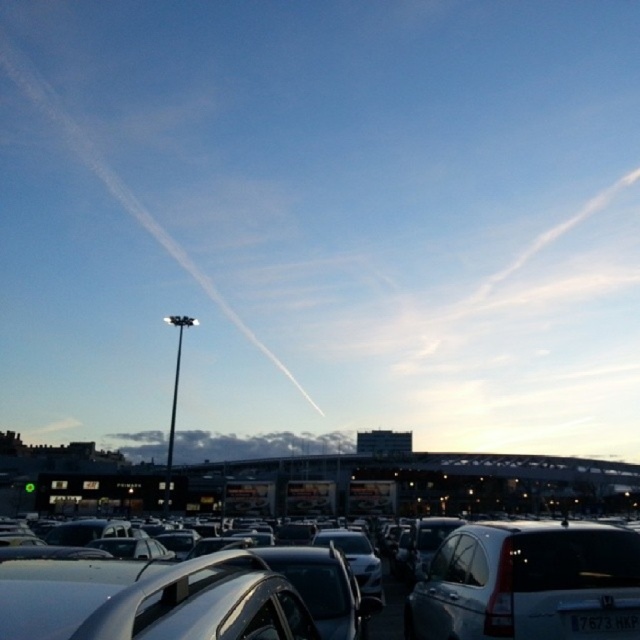
Question: From the image, what is the correct spatial relationship of silver metallic car at center in relation to white matte sedan at lower right?

Choices:
 (A) above
 (B) below

Answer: (A)

Question: Among these points, which one is nearest to the camera?

Choices:
 (A) (509, 577)
 (B) (586, 621)

Answer: (B)

Question: Does white matte sedan at lower right have a smaller size compared to white plastic license plate at center?

Choices:
 (A) no
 (B) yes

Answer: (A)

Question: Considering the real-world distances, which object is closest to the silver metallic car at center?

Choices:
 (A) white plastic license plate at center
 (B) white matte sedan at lower right

Answer: (A)

Question: Based on their relative distances, which object is farther from the white plastic license plate at center?

Choices:
 (A) white matte sedan at lower right
 (B) silver metallic car at center

Answer: (B)

Question: Is silver metallic car at center to the left of white matte sedan at lower right from the viewer's perspective?

Choices:
 (A) no
 (B) yes

Answer: (B)